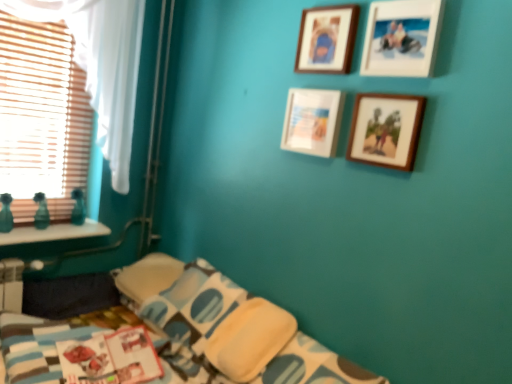
Question: Is white matte picture frame at center, which appears as the second picture frame when ordered from the bottom, to the left or to the right of green glass vases at left in the image?

Choices:
 (A) left
 (B) right

Answer: (B)

Question: Is white matte picture frame at center, which is counted as the 3th picture frame, starting from the top, bigger or smaller than green glass vases at left?

Choices:
 (A) big
 (B) small

Answer: (B)

Question: Considering the real-world distances, which object is farthest from the wooden picture frame at upper center, which is counted as the fourth picture frame, starting from the bottom?

Choices:
 (A) white sheer curtain at left
 (B) wooden photo frame at upper right, which is counted as the third picture frame, starting from the bottom
 (C) wooden photo frame at upper right, the 1th picture frame positioned from the bottom
 (D) white matte picture frame at center, which appears as the second picture frame when ordered from the bottom
 (E) green glass vases at left

Answer: (E)

Question: Considering the real-world distances, which object is closest to the green glass vases at left?

Choices:
 (A) white matte picture frame at center, which appears as the second picture frame when ordered from the bottom
 (B) wooden photo frame at upper right, the second picture frame viewed from the top
 (C) yellow soft pillow at lower right
 (D) wooden picture frame at upper center, which is counted as the fourth picture frame, starting from the bottom
 (E) wooden photo frame at upper right, the 1th picture frame positioned from the bottom

Answer: (C)